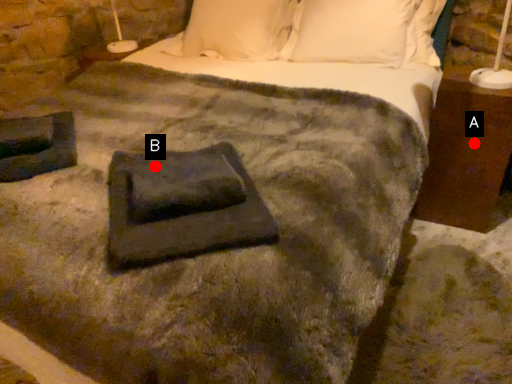
Question: Two points are circled on the image, labeled by A and B beside each circle. Which point is farther to the camera?

Choices:
 (A) A is further
 (B) B is further

Answer: (A)